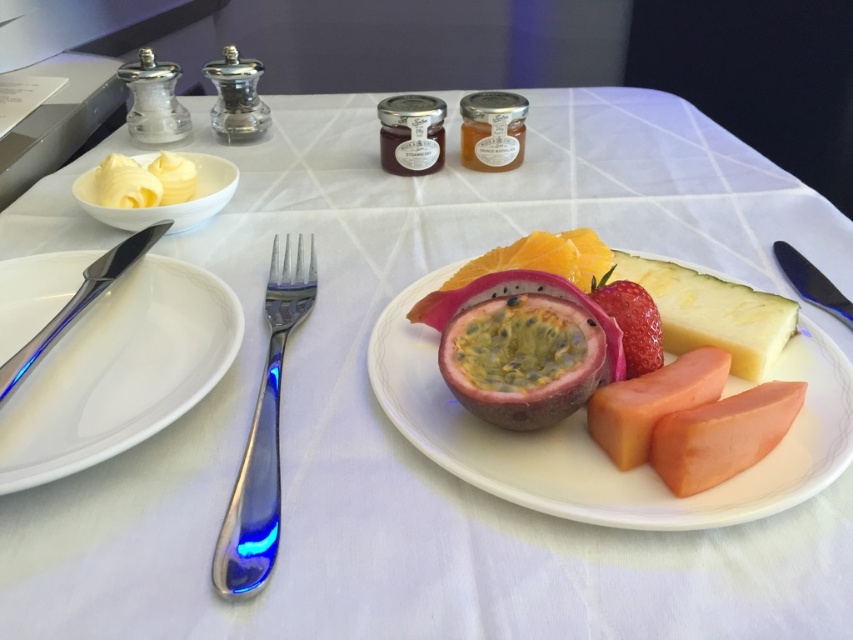
You are a guest at a breakfast table and want to reach for the orange fleshed at center. Is the polished silver fork at left blocking your path to it?

The polished silver fork at left is in front of the orange fleshed at center, so it is blocking the path to the orange fleshed at center.